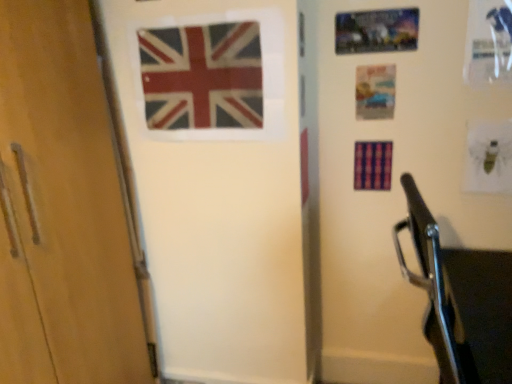
Question: Is matte paper postcard at upper right, which is the 1th postcard from bottom to top, wider or thinner than metallic silver postcard at upper right, arranged as the 1th postcard when viewed from the top?

Choices:
 (A) thin
 (B) wide

Answer: (A)

Question: Relative to metallic silver postcard at upper right, arranged as the 1th postcard when viewed from the top, is matte paper postcard at upper right, which is the 1th postcard from bottom to top, in front or behind?

Choices:
 (A) front
 (B) behind

Answer: (B)

Question: Which of these objects is positioned closest to the matte paper postcard at upper right, acting as the 2th postcard starting from the top?

Choices:
 (A) matte plastic flag at center, the 2th flag in the right-to-left sequence
 (B) metallic silver postcard at upper right, arranged as the 1th postcard when viewed from the top
 (C) matte fabric flag at upper center, the third flag viewed from the right
 (D) plaid fabric flag at center, the third flag viewed from the left

Answer: (B)

Question: Estimate the real-world distances between objects in this image. Which object is farther from the plaid fabric flag at center, which is the first flag in right-to-left order?

Choices:
 (A) matte fabric flag at upper center, the third flag viewed from the right
 (B) metallic silver postcard at upper right, arranged as the 1th postcard when viewed from the top
 (C) matte paper postcard at upper right, which is the 1th postcard from bottom to top
 (D) matte plastic flag at center, the 2th flag in the right-to-left sequence

Answer: (A)